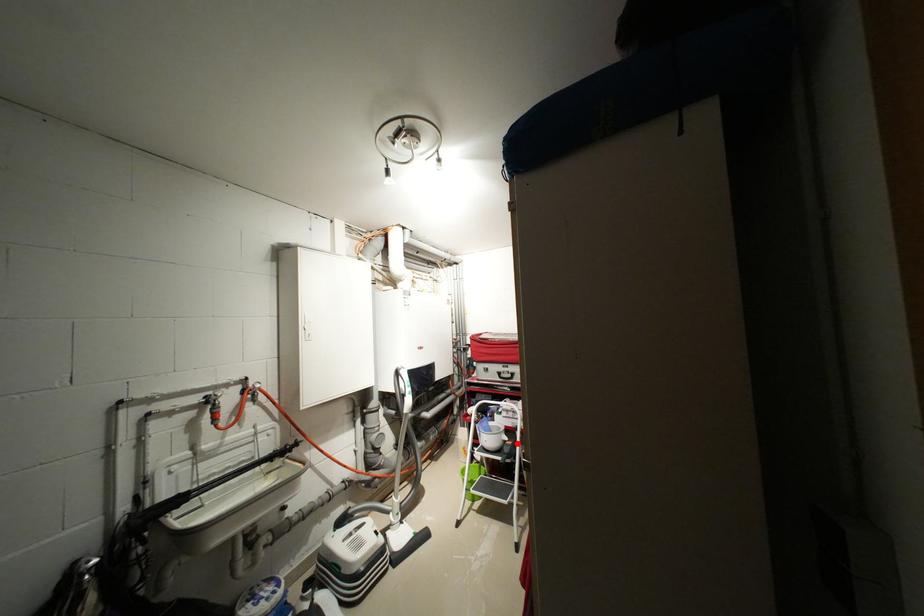
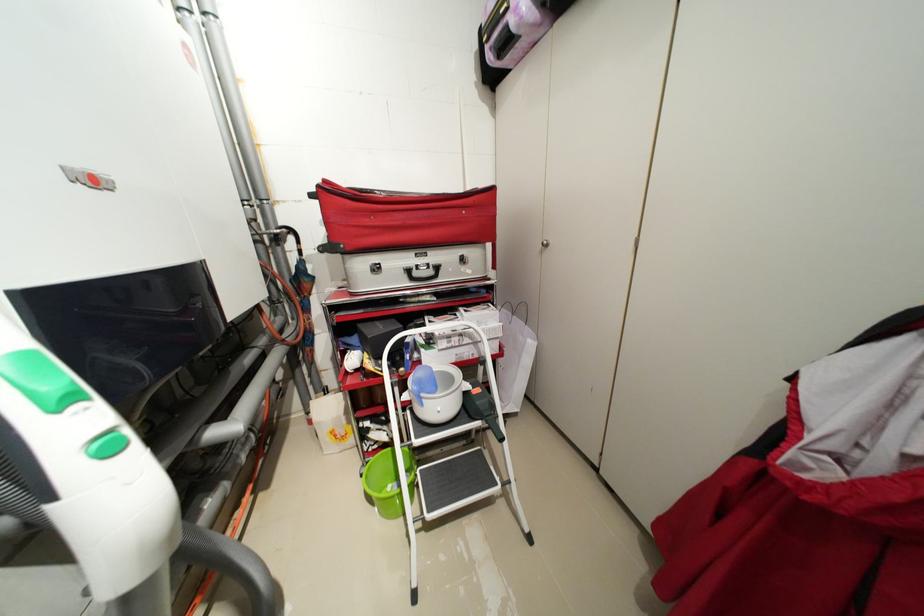
Question: I am providing you with two images of the same scene from different viewpoints. In image1, a red point is highlighted. Considering the same 3D point in image2, which of the following is correct?

Choices:
 (A) It is closer
 (B) It is farther

Answer: (A)